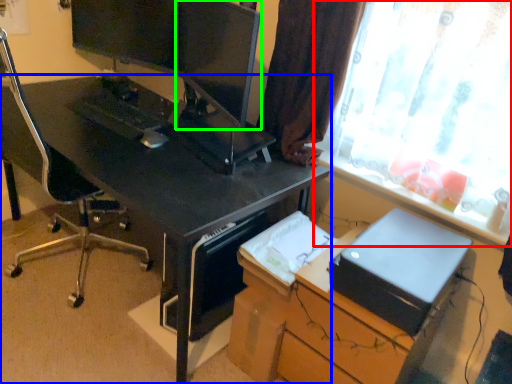
Question: Estimate the real-world distances between objects in this image. Which object is closer to window (highlighted by a red box), desk (highlighted by a blue box) or computer monitor (highlighted by a green box)?

Choices:
 (A) desk
 (B) computer monitor

Answer: (A)